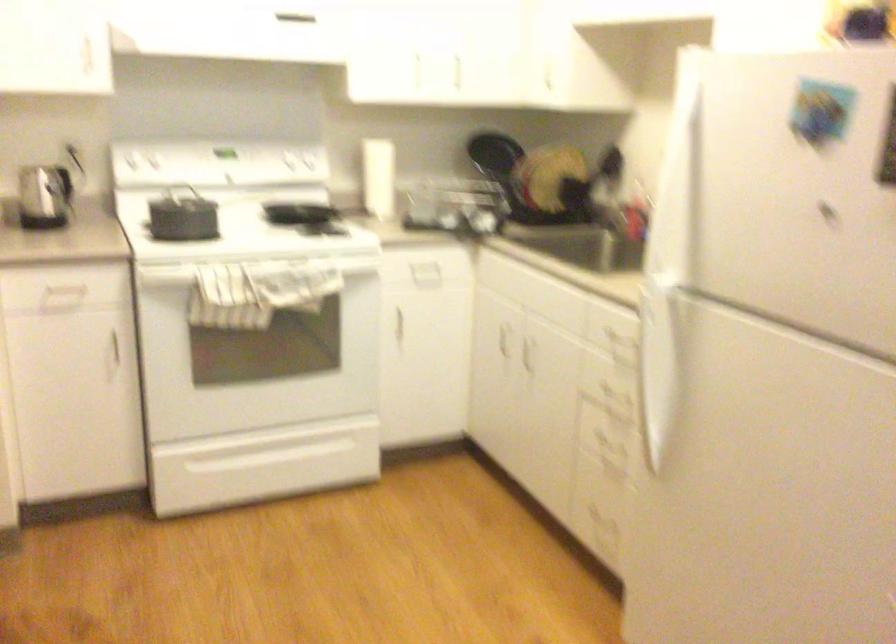
Find where to pull the oven drawer handle. Please return your answer as a coordinate pair (x, y).

(280, 446)